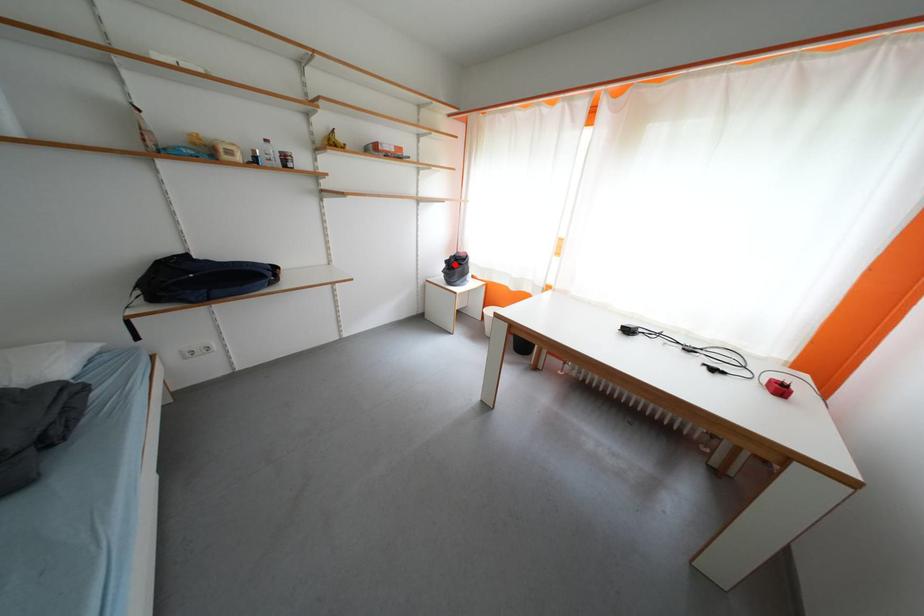
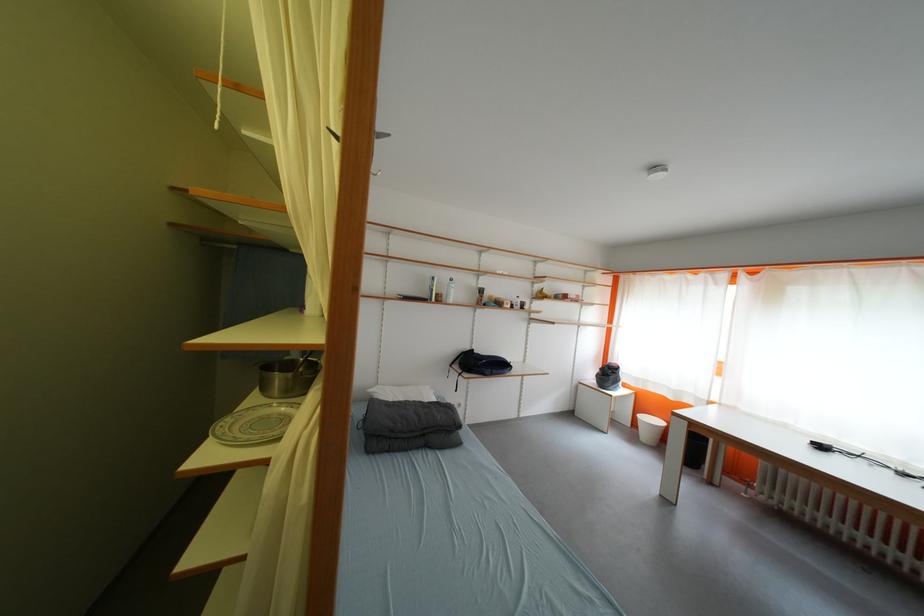
Question: I am providing you with two images of the same scene from different viewpoints. Given a red point in image1, look at the same physical point in image2. Is it:

Choices:
 (A) Closer to the viewpoint
 (B) Farther from the viewpoint

Answer: (B)